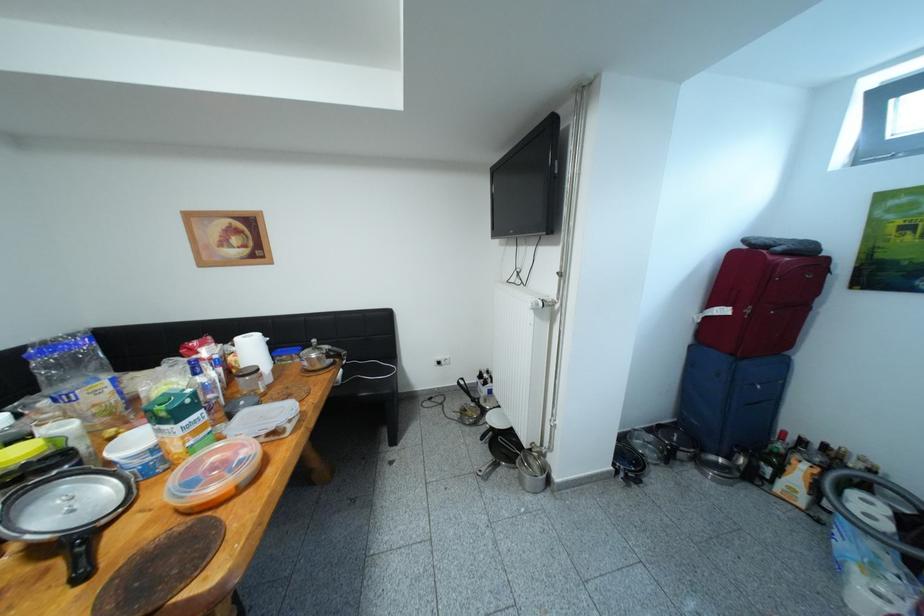
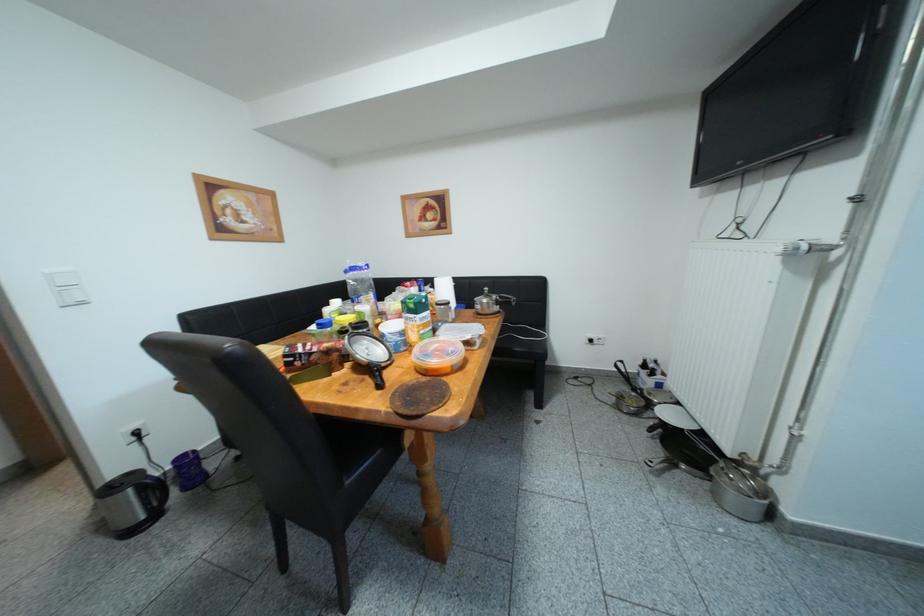
Question: How did the camera likely rotate?

Choices:
 (A) Left
 (B) Right
 (C) Up
 (D) Down

Answer: (A)